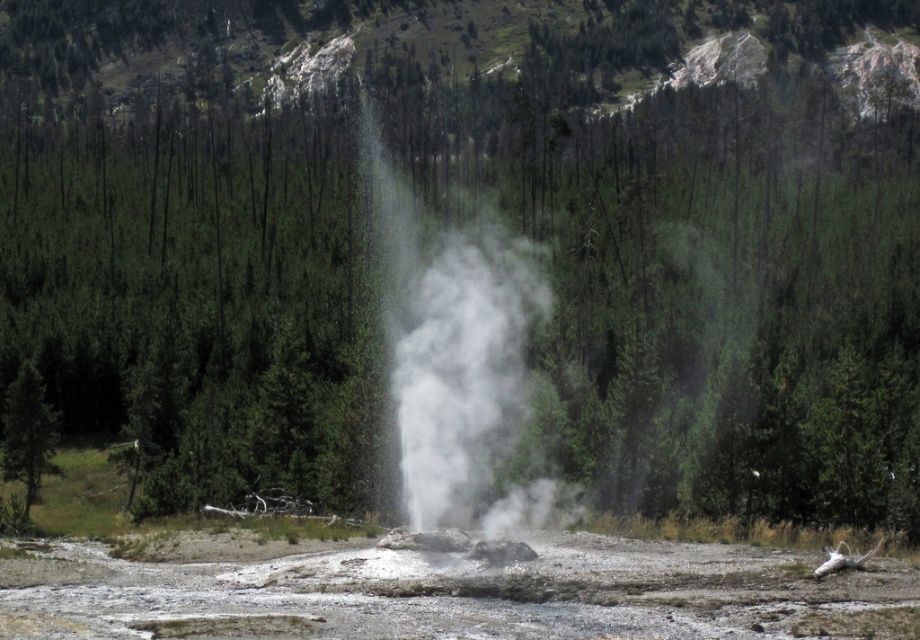
Does white vapor at center have a larger size compared to green matte tree at left?

Correct, white vapor at center is larger in size than green matte tree at left.

Which is more to the right, white vapor at center or green matte tree at left?

From the viewer's perspective, white vapor at center appears more on the right side.

The image size is (920, 640). I want to click on white vapor at center, so click(456, 356).